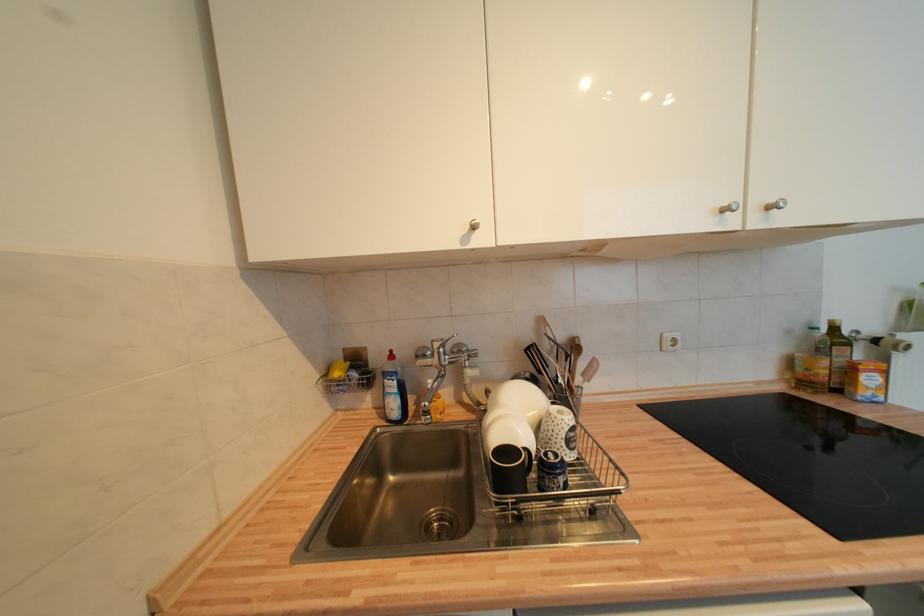
Where is `pink utensil handle`? pink utensil handle is located at coordinates (589, 371).